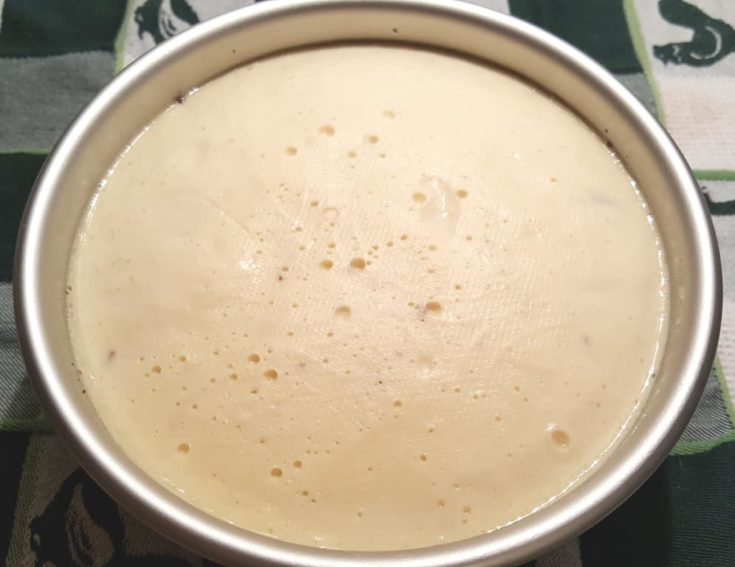
Identify the location of bowl. Image resolution: width=735 pixels, height=567 pixels. (577, 519), (609, 124), (67, 190).